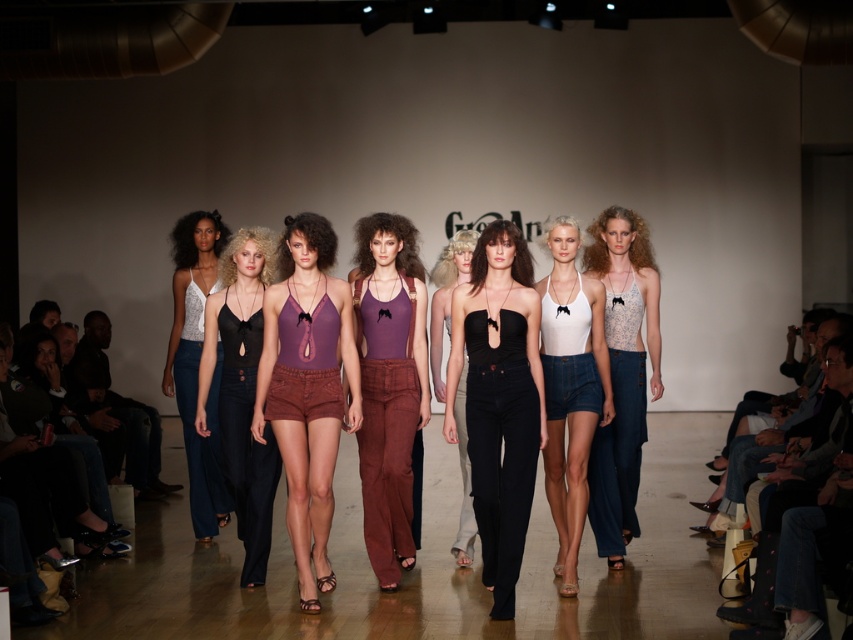
You are a photographer at the runway show. You need to capture a photo where both the black matte top at center and the black matte dress at center are visible. Which one should you position to the left in your camera frame to ensure both are in the shot?

To ensure both the black matte top at center and the black matte dress at center are visible, you should position the black matte dress at center to the left in your camera frame since the black matte top at center is to the right of the dress.

You are a fashion designer observing the runway show. You notice the black matte top at center and the light blue denim skirt at right. Which clothing item is positioned lower on the model?

The black matte top at center is positioned lower on the model because it is below the light blue denim skirt at right.

You are a stylist observing the runway show. You notice the purple fabric shorts at center and the matte white tank top at left. Which clothing item is located to the right of the other?

The purple fabric shorts at center is positioned on the right side of matte white tank top at left.